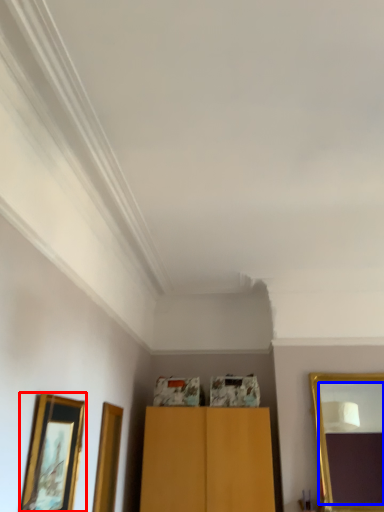
Question: Which object is closer to the camera taking this photo, picture frame (highlighted by a red box) or mirror (highlighted by a blue box)?

Choices:
 (A) picture frame
 (B) mirror

Answer: (A)